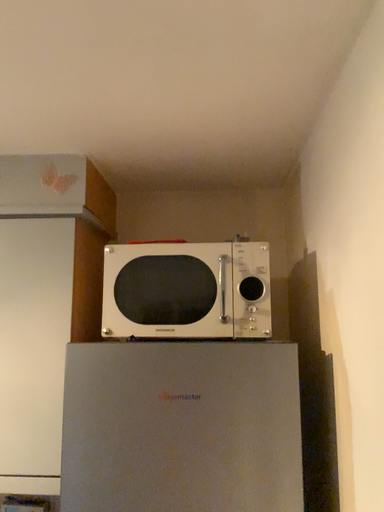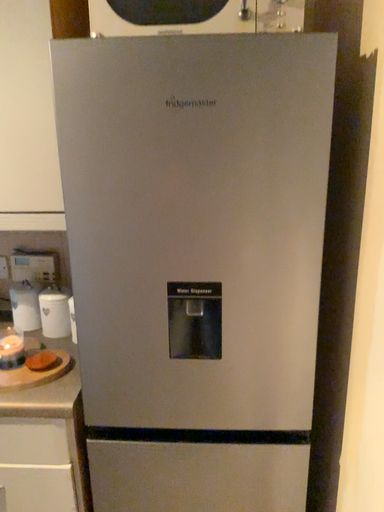
Question: Which way did the camera rotate in the video?

Choices:
 (A) rotated downward
 (B) rotated upward

Answer: (A)